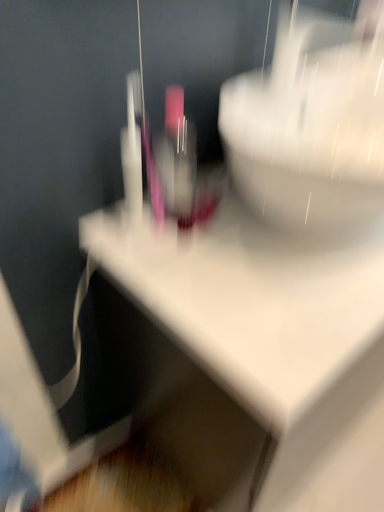
I want to click on empty space that is ontop of white glossy table at center, so click(270, 244).